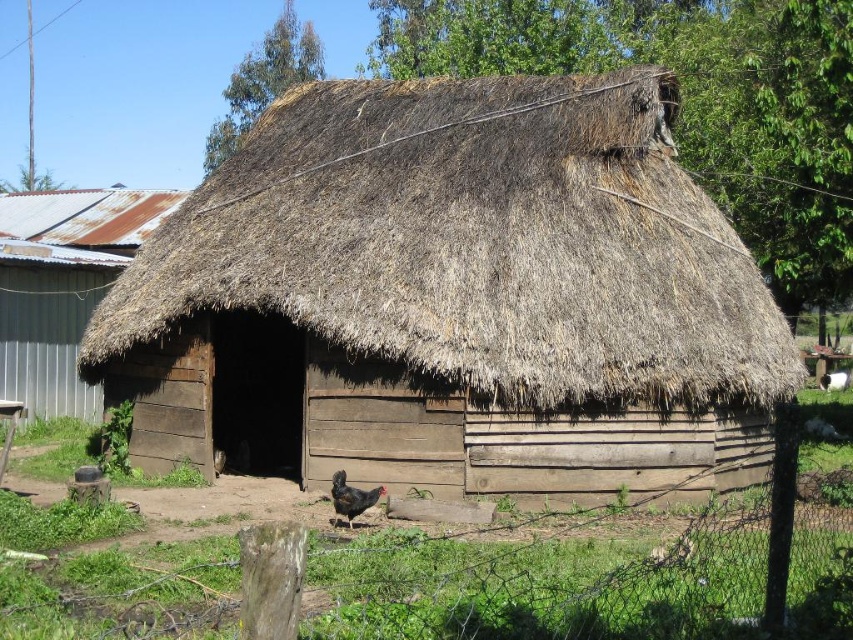
Can you confirm if brown wooden hut at center is positioned to the left of green grass at center?

Correct, you'll find brown wooden hut at center to the left of green grass at center.

You are a GUI agent. You are given a task and a screenshot of the screen. Output one action in this format:
    pyautogui.click(x=<x>, y=<y>)
    Task: Click on the brown wooden hut at center
    This screenshot has width=853, height=640.
    Given the screenshot: What is the action you would take?
    pyautogui.click(x=453, y=300)

Between brown wooden hut at center and black feathered chicken at center, which one has less height?

black feathered chicken at center

Who is higher up, brown wooden hut at center or black feathered chicken at center?

brown wooden hut at center

Image resolution: width=853 pixels, height=640 pixels. I want to click on brown wooden hut at center, so click(453, 300).

Is point (218, 621) less distant than point (364, 499)?

Yes, point (218, 621) is closer to viewer.

This screenshot has width=853, height=640. I want to click on green grass at center, so click(390, 570).